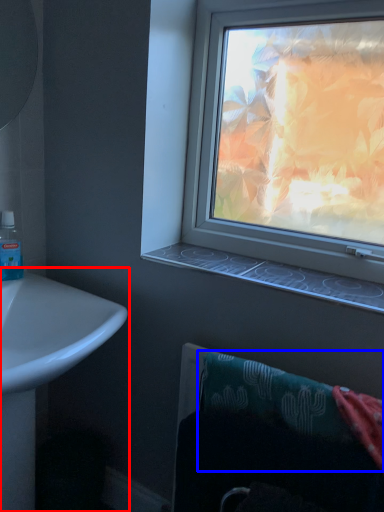
Question: Among these objects, which one is nearest to the camera, sink (highlighted by a red box) or bath towel (highlighted by a blue box)?

Choices:
 (A) sink
 (B) bath towel

Answer: (A)